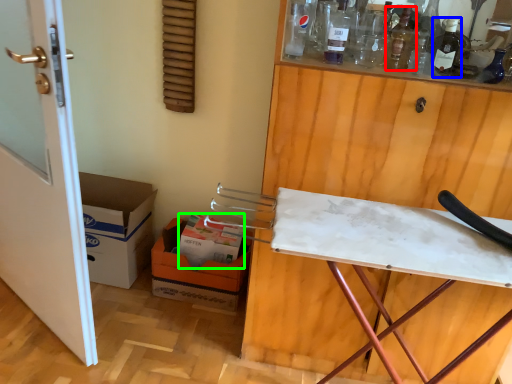
Question: Which is nearer to the wine bottle (highlighted by a red box)? wine bottle (highlighted by a blue box) or box (highlighted by a green box).

Choices:
 (A) wine bottle
 (B) box

Answer: (A)